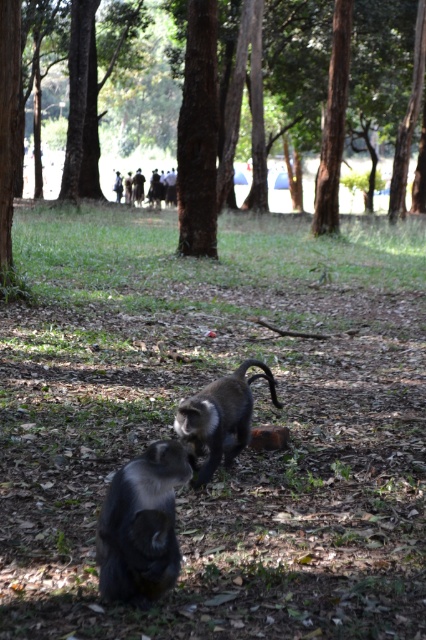
Is silvery fur monkey at center shorter than brown textured tree at center?

Yes, silvery fur monkey at center is shorter than brown textured tree at center.

In the scene shown: Who is lower down, silvery fur monkey at center or brown textured tree at center?

silvery fur monkey at center is lower down.

I want to click on silvery fur monkey at center, so click(253, 422).

Consider the image. Does silvery fur monkey at center have a greater width compared to shiny brown monkey at center?

Indeed, silvery fur monkey at center has a greater width compared to shiny brown monkey at center.

How much distance is there between silvery fur monkey at center and shiny brown monkey at center?

They are 2.75 meters apart.

Does point (209, 316) come farther from viewer compared to point (215, 401)?

Yes.

Locate an element on the screen. silvery fur monkey at center is located at coordinates (253, 422).

Does shiny black monkey at lower left appear under shiny brown monkey at center?

Indeed, shiny black monkey at lower left is positioned under shiny brown monkey at center.

Which is behind, point (106, 592) or point (190, 433)?

Point (190, 433)

You are a GUI agent. You are given a task and a screenshot of the screen. Output one action in this format:
    pyautogui.click(x=<x>, y=<y>)
    Task: Click on the shiny black monkey at lower left
    The height and width of the screenshot is (640, 426).
    Given the screenshot: What is the action you would take?
    pyautogui.click(x=141, y=525)